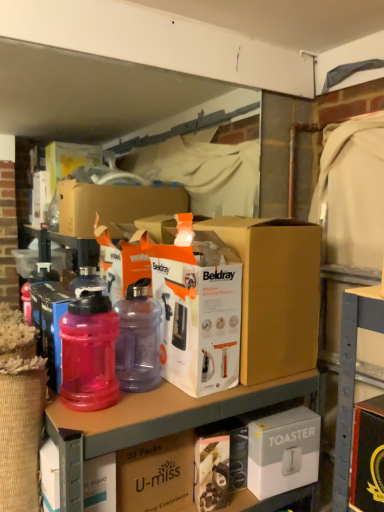
Image resolution: width=384 pixels, height=512 pixels. What are the coordinates of `free space above white cardboard toaster at lower right, which ranks as the fourth box in left-to-right order (from a real-world perspective)` in the screenshot? It's located at (277, 414).